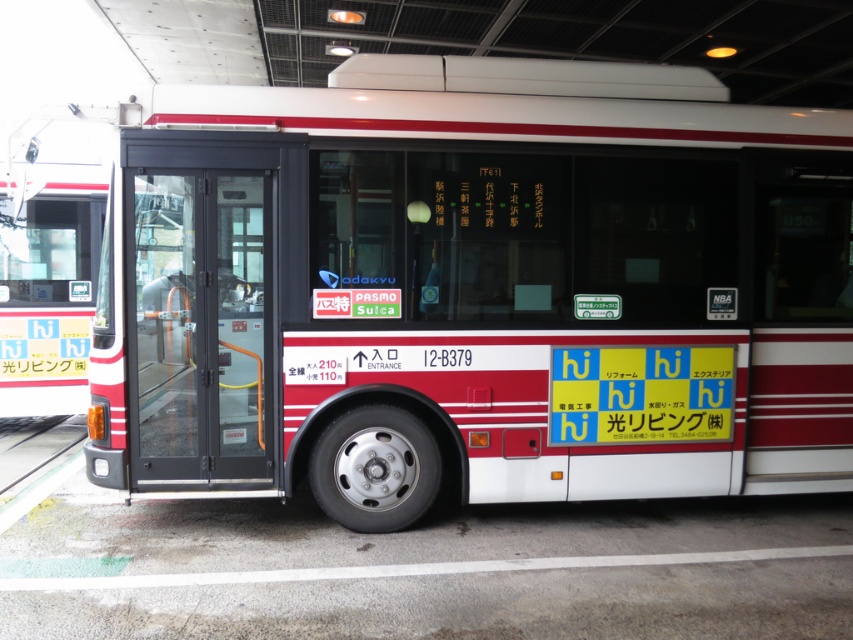
Based on the photo, you are standing at the entrance of the station and want to board the red and white bus. Where is the black glass door at center located in relation to the bus?

The black glass door at center is located at point 0.514 in the x coordinate and 0.234 in the y coordinate relative to the bus.

You are a passenger waiting to board the bus and notice two items near the entrance. Which one is positioned to the left of the other? The black glass door at center and the white plastic license plate at center.

The black glass door at center is positioned to the left of the white plastic license plate at center.